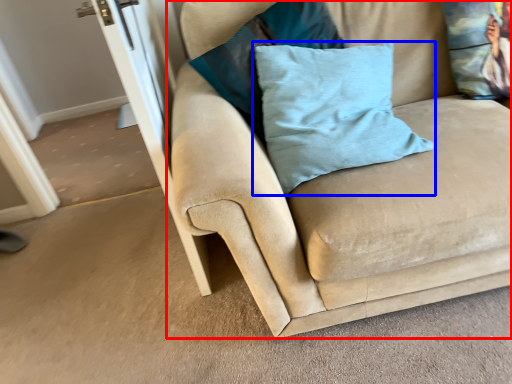
Question: Which point is closer to the camera, studio couch (highlighted by a red box) or pillow (highlighted by a blue box)?

Choices:
 (A) studio couch
 (B) pillow

Answer: (A)